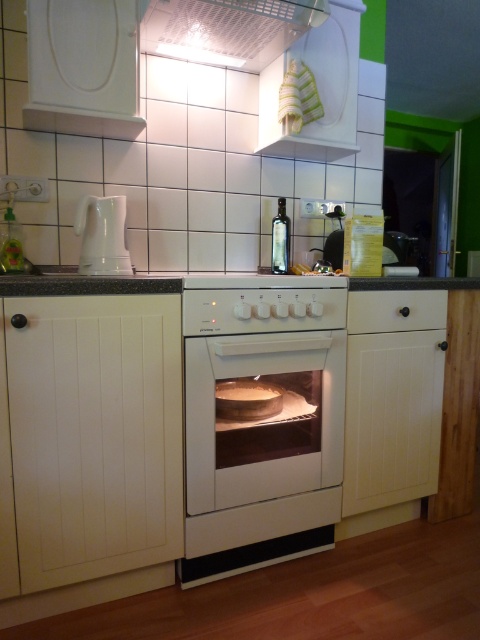
Question: Is white matte oven at center to the right of granite/black at center from the viewer's perspective?

Choices:
 (A) no
 (B) yes

Answer: (B)

Question: Is metallic grid at upper center further to camera compared to white glossy kettle at left?

Choices:
 (A) yes
 (B) no

Answer: (B)

Question: Which of the following is the closest to the observer?

Choices:
 (A) white matte oven at center
 (B) granite/black at center
 (C) white glossy kettle at left

Answer: (B)

Question: Which point is closer to the camera?

Choices:
 (A) (88, 280)
 (B) (284, 369)

Answer: (A)

Question: Which of the following is the closest to the observer?

Choices:
 (A) [x=194, y=17]
 (B) [x=354, y=300]

Answer: (A)

Question: Considering the relative positions of granite/black at center and white glossy kettle at left in the image provided, where is granite/black at center located with respect to white glossy kettle at left?

Choices:
 (A) above
 (B) below

Answer: (B)